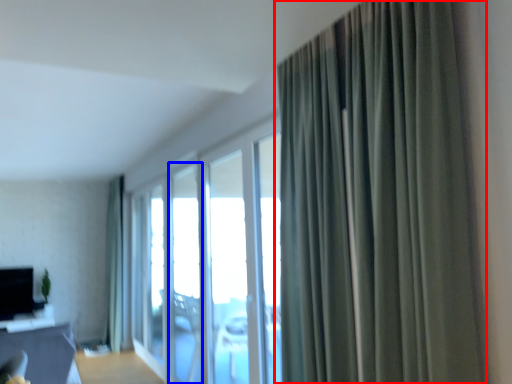
Question: Which object is closer to the camera taking this photo, curtain (highlighted by a red box) or window (highlighted by a blue box)?

Choices:
 (A) curtain
 (B) window

Answer: (A)